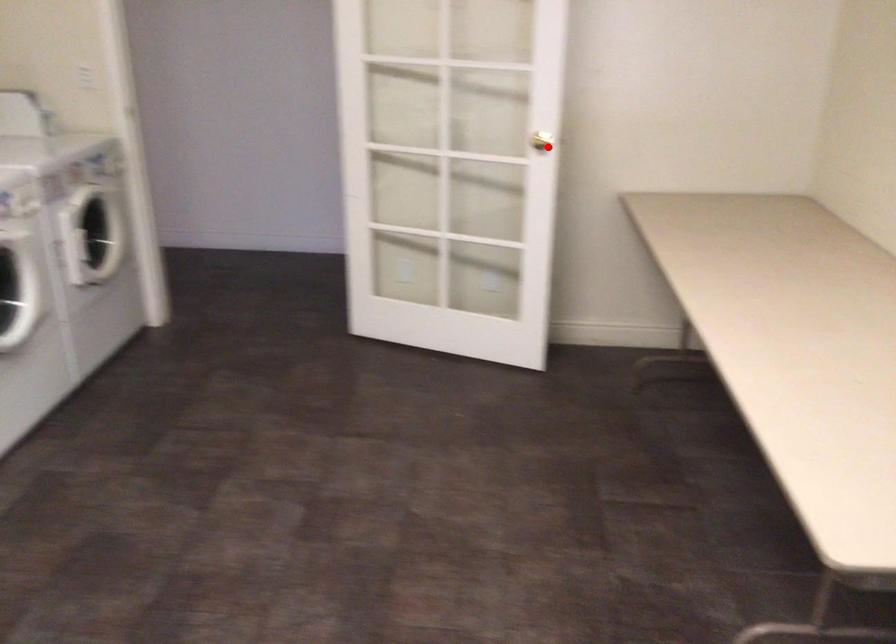
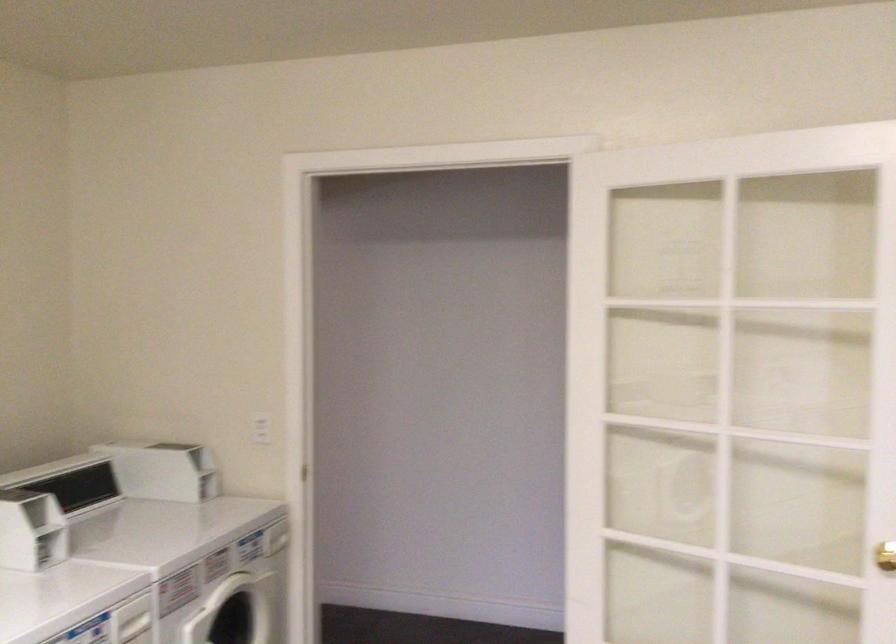
In the second image, find the point that corresponds to the highlighted location in the first image.

(885, 556)